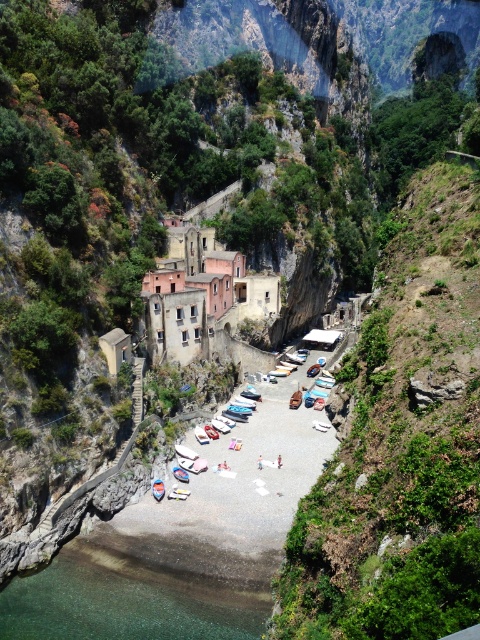
Does white glossy boat at center have a larger size compared to white fabric person at center?

Correct, white glossy boat at center is larger in size than white fabric person at center.

Image resolution: width=480 pixels, height=640 pixels. Describe the element at coordinates (157, 488) in the screenshot. I see `white glossy boat at center` at that location.

Is point (160, 484) positioned in front of point (280, 456)?

That is True.

Identify the location of white glossy boat at center. The width and height of the screenshot is (480, 640). (157, 488).

Does clear glass water at lower left have a greater width compared to white glossy boat at center?

Indeed, clear glass water at lower left has a greater width compared to white glossy boat at center.

Can you confirm if clear glass water at lower left is smaller than white glossy boat at center?

No, clear glass water at lower left is not smaller than white glossy boat at center.

Locate an element on the screen. The width and height of the screenshot is (480, 640). clear glass water at lower left is located at coordinates (127, 600).

From the picture: Can you confirm if clear glass water at lower left is positioned to the left of white fabric person at center?

Indeed, clear glass water at lower left is positioned on the left side of white fabric person at center.

Who is shorter, clear glass water at lower left or white fabric person at center?

Standing shorter between the two is white fabric person at center.

Is point (91, 589) in front of point (279, 454)?

That is True.

Where is `clear glass water at lower left`? clear glass water at lower left is located at coordinates (127, 600).